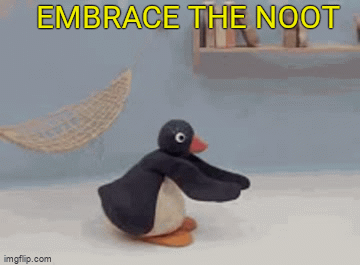
The image size is (360, 265). Identify the location of shelf. click(205, 63).